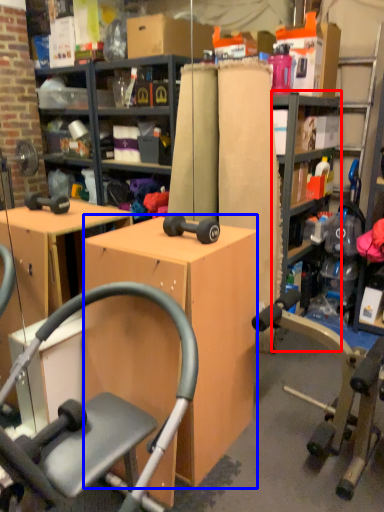
Question: Which point is closer to the camera, bookshelf (highlighted by a red box) or desk (highlighted by a blue box)?

Choices:
 (A) bookshelf
 (B) desk

Answer: (B)